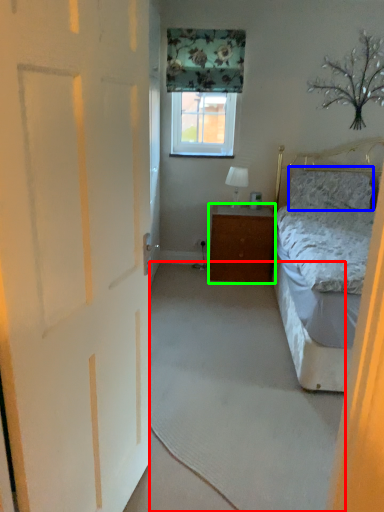
Question: Which is farther away from plain (highlighted by a red box)? pillow (highlighted by a blue box) or cabinetry (highlighted by a green box)?

Choices:
 (A) pillow
 (B) cabinetry

Answer: (A)